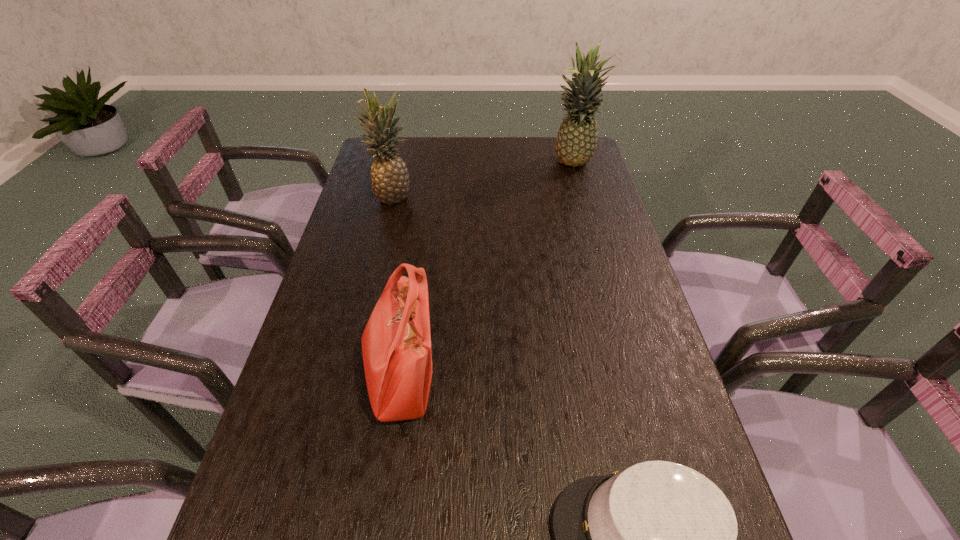
Select which object appears as the third closest to the handbag. Please provide its 2D coordinates. Your answer should be formatted as a tuple, i.e. [(x, y)], where the tuple contains the x and y coordinates of a point satisfying the conditions above.

[(576, 142)]

Select which object appears as the second closest to the farthest object. Please provide its 2D coordinates. Your answer should be formatted as a tuple, i.e. [(x, y)], where the tuple contains the x and y coordinates of a point satisfying the conditions above.

[(396, 343)]